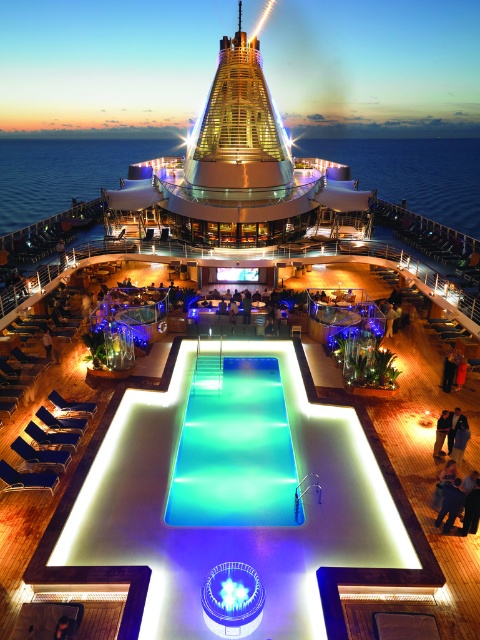
Question: Is blue glossy pool at center behind shiny metallic cruise ship at upper center?

Choices:
 (A) yes
 (B) no

Answer: (B)

Question: Which object is closer to the camera taking this photo?

Choices:
 (A) shiny metallic cruise ship at upper center
 (B) blue glossy pool at center

Answer: (B)

Question: Which object is positioned closest to the translucent glass pool at center?

Choices:
 (A) shiny metallic cruise ship at upper center
 (B) blue glossy pool at center

Answer: (B)

Question: Where is shiny metallic cruise ship at upper center located in relation to translucent glass pool at center in the image?

Choices:
 (A) below
 (B) above

Answer: (B)

Question: Which of the following is the farthest from the observer?

Choices:
 (A) blue glossy pool at center
 (B) shiny metallic cruise ship at upper center

Answer: (B)

Question: Is blue glossy pool at center to the left of shiny metallic cruise ship at upper center from the viewer's perspective?

Choices:
 (A) yes
 (B) no

Answer: (B)